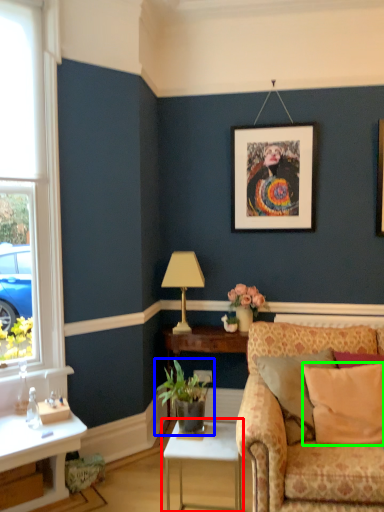
Question: Which is farther away from table (highlighted by a red box)? houseplant (highlighted by a blue box) or pillow (highlighted by a green box)?

Choices:
 (A) houseplant
 (B) pillow

Answer: (B)